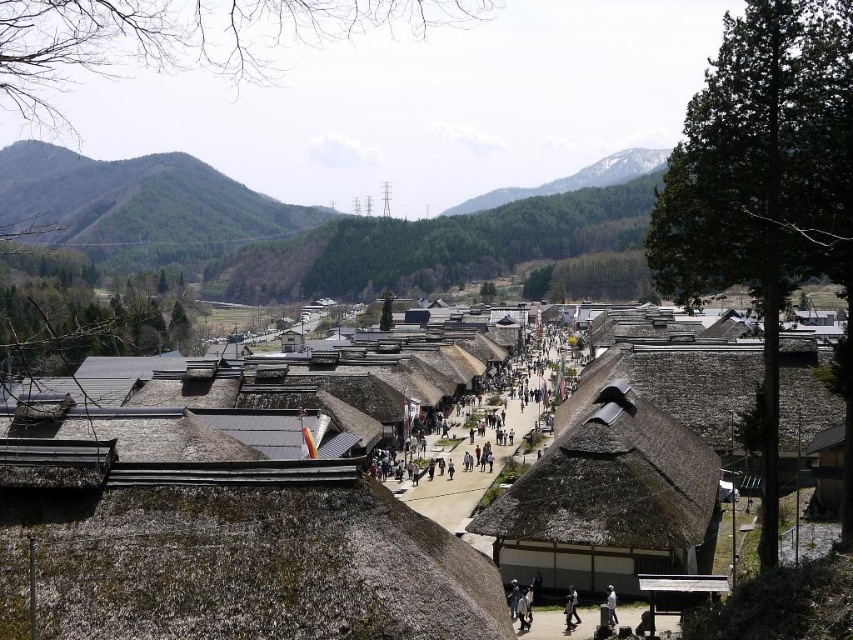
Question: Which of the following is the farthest from the observer?

Choices:
 (A) (460, 372)
 (B) (527, 628)

Answer: (A)

Question: Is brown thatch roof at center closer to camera compared to green forested mountain at upper center?

Choices:
 (A) yes
 (B) no

Answer: (A)

Question: Is thatched roof village at center smaller than green forested mountain at upper center?

Choices:
 (A) yes
 (B) no

Answer: (A)

Question: Is dark brown thatched roof at center to the right of white fabric person at lower center from the viewer's perspective?

Choices:
 (A) yes
 (B) no

Answer: (B)

Question: Which of these objects is positioned closest to the brown thatch roof at center?

Choices:
 (A) dark brown thatched roof at center
 (B) thatched roof village at center
 (C) white fabric person at lower center
 (D) light gray fabric jacket at lower center

Answer: (B)

Question: Which object appears farthest from the camera in this image?

Choices:
 (A) light gray fabric pants at lower center
 (B) green forested mountain at upper center

Answer: (B)